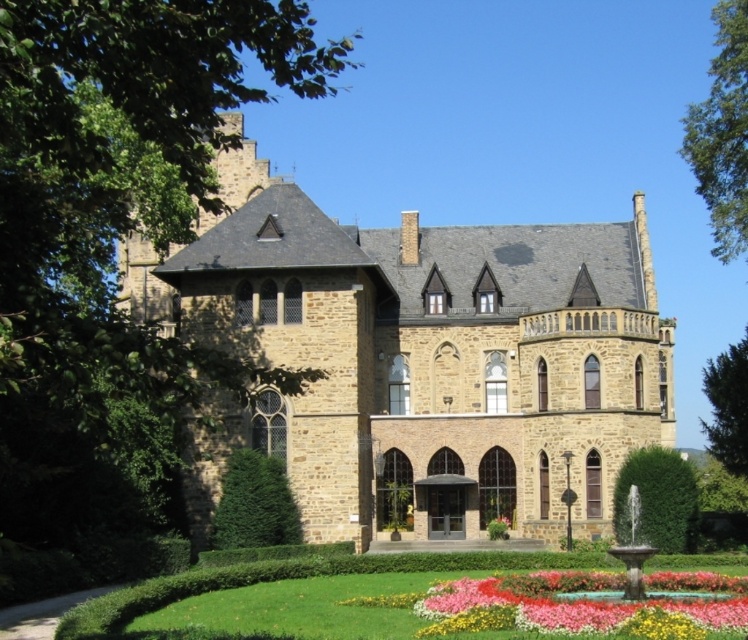
You are standing in front of the historic stone building and want to locate two specific points marked on the facade. The first point is at coordinates point (475, 560) and the second is at point (568, 630). Which of these points is closer to your current position?

Point (475, 560) is closer to your current position because it is further to the viewer than point (568, 630).

You are standing in front of the historic stone building and notice the green grass at lower center and the pink fabric flower at center. Which object is wider?

The green grass at lower center is wider than the pink fabric flower at center.

You are standing in front of the grand stone building and notice the green grass at lower center and the pink fabric flower at center. Which object is located directly above the other?

→ The pink fabric flower at center is positioned above the green grass at lower center.